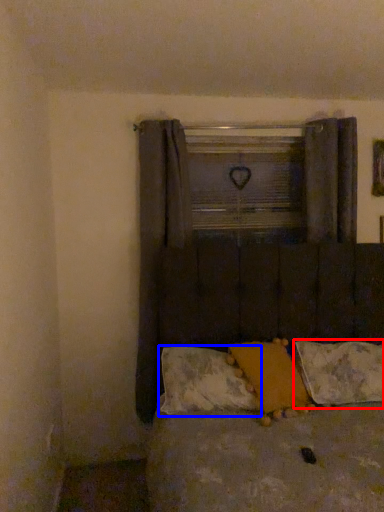
Question: Among these objects, which one is farthest to the camera, pillow (highlighted by a red box) or pillow (highlighted by a blue box)?

Choices:
 (A) pillow
 (B) pillow

Answer: (A)